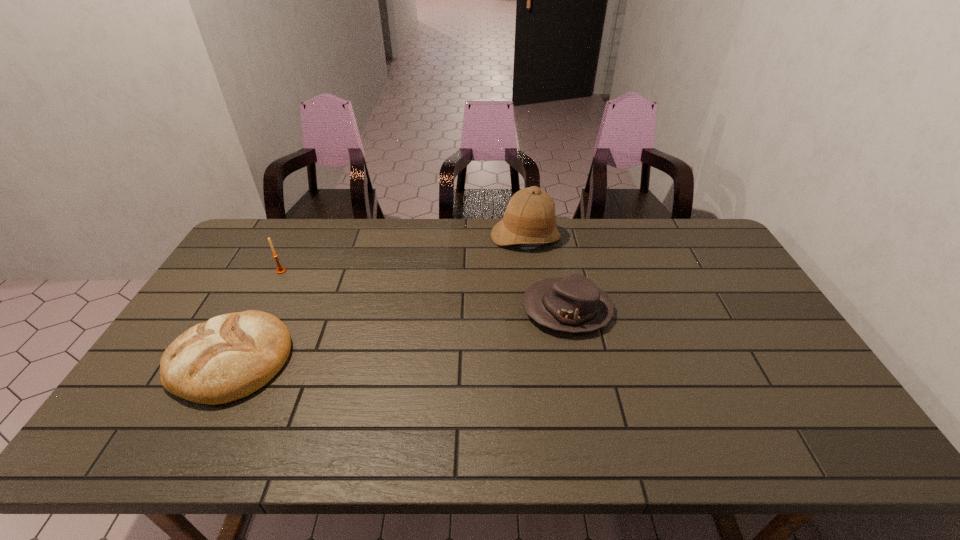
Find the location of a particular element. Image resolution: width=960 pixels, height=540 pixels. vacant space located 0.310m on the decorative side of the nearer hat is located at coordinates (418, 310).

Image resolution: width=960 pixels, height=540 pixels. What are the coordinates of `vacant space located 0.060m on the front of the bread` in the screenshot? It's located at (192, 431).

Locate an element on the screen. The width and height of the screenshot is (960, 540). object situated at the far edge is located at coordinates (529, 218).

You are a GUI agent. You are given a task and a screenshot of the screen. Output one action in this format:
    pyautogui.click(x=<x>, y=<y>)
    Task: Click on the object present at the left edge
    The height and width of the screenshot is (540, 960).
    Given the screenshot: What is the action you would take?
    (x=230, y=356)

Find the location of `vacant space at the far edge of the desktop`. vacant space at the far edge of the desktop is located at coordinates (427, 247).

Image resolution: width=960 pixels, height=540 pixels. Identify the location of vacant space at the near edge of the desktop. (422, 430).

Identify the location of vacant space at the right edge. (752, 386).

The image size is (960, 540). What are the coordinates of `vacant space at the far left corner of the desktop` in the screenshot? It's located at (239, 246).

Identify the location of free space at the near right corner. This screenshot has width=960, height=540. (803, 436).

You are a GUI agent. You are given a task and a screenshot of the screen. Output one action in this format:
    pyautogui.click(x=<x>, y=<y>)
    Task: Click on the vacant area that lies between the taller hat and the bread
    
    Given the screenshot: What is the action you would take?
    pyautogui.click(x=378, y=298)